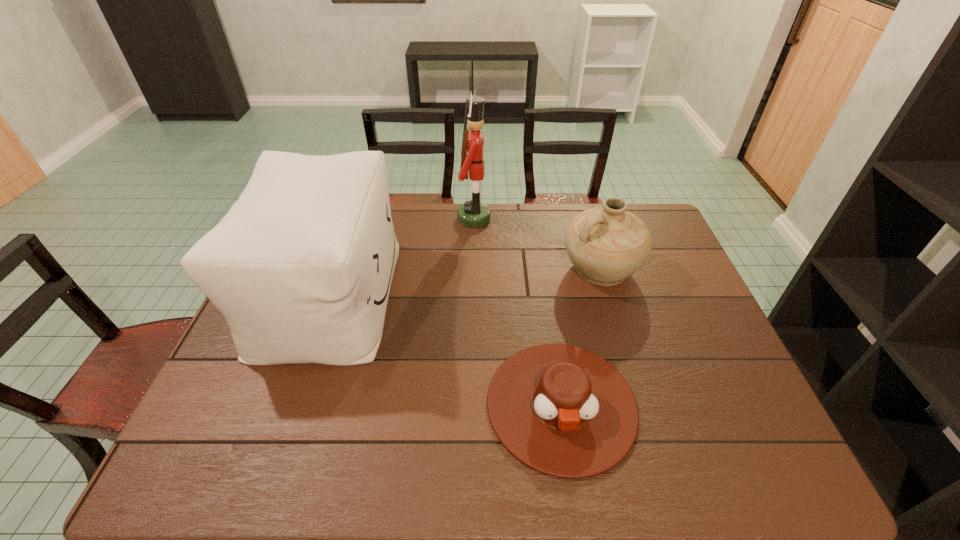
Where is `cushion located at the far edge`? The image size is (960, 540). cushion located at the far edge is located at coordinates (301, 267).

Find the location of a particular element. This screenshot has height=540, width=960. object that is at the near edge is located at coordinates tap(561, 410).

The width and height of the screenshot is (960, 540). In order to click on object located at the left edge in this screenshot , I will do `click(301, 267)`.

This screenshot has width=960, height=540. I want to click on object that is at the right edge, so click(x=606, y=245).

Locate an element on the screen. object situated at the far left corner is located at coordinates (301, 267).

Locate an element on the screen. Image resolution: width=960 pixels, height=540 pixels. free point at the far edge is located at coordinates (598, 204).

I want to click on free region at the near edge, so click(676, 455).

Where is `vacant space at the right edge of the desktop`? This screenshot has height=540, width=960. vacant space at the right edge of the desktop is located at coordinates (704, 313).

Identify the location of vacant region at the far right corner. The height and width of the screenshot is (540, 960). (663, 228).

Where is `free spot between the pottery and the nutcracker`? The width and height of the screenshot is (960, 540). free spot between the pottery and the nutcracker is located at coordinates (538, 244).